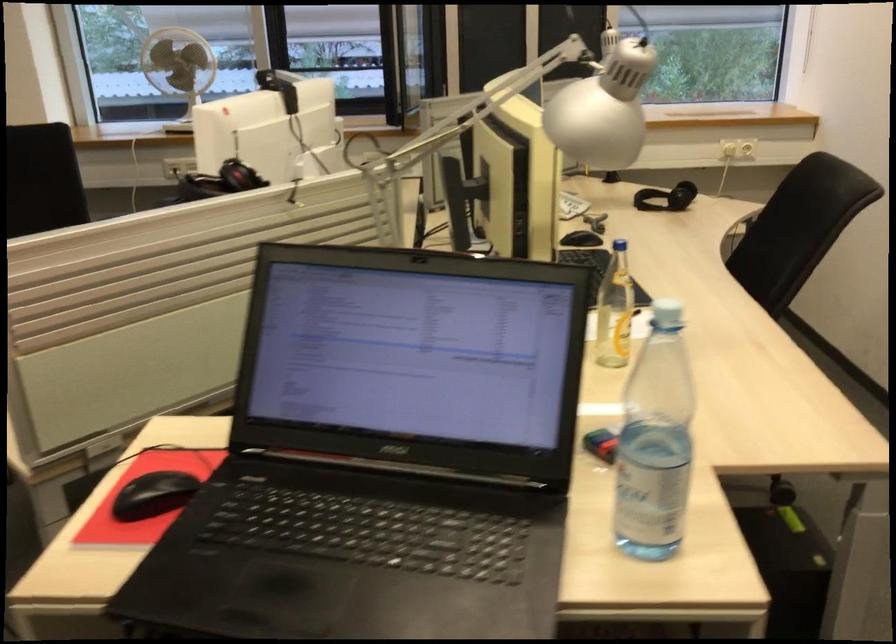
I want to click on black headphones, so click(x=666, y=198).